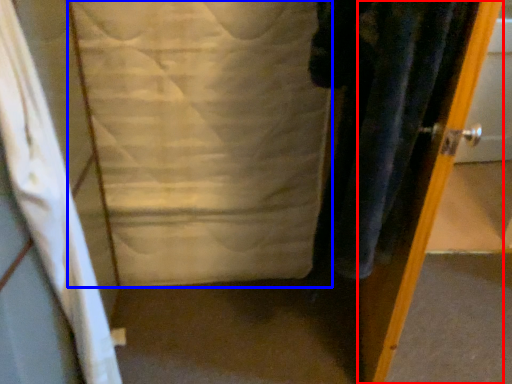
Question: Among these objects, which one is farthest to the camera, door (highlighted by a red box) or sheet (highlighted by a blue box)?

Choices:
 (A) door
 (B) sheet

Answer: (B)